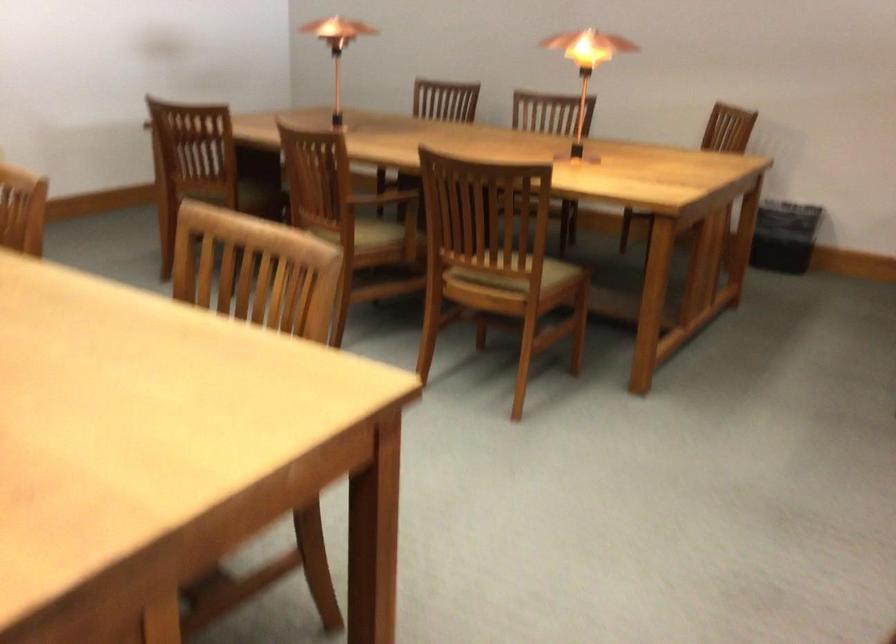
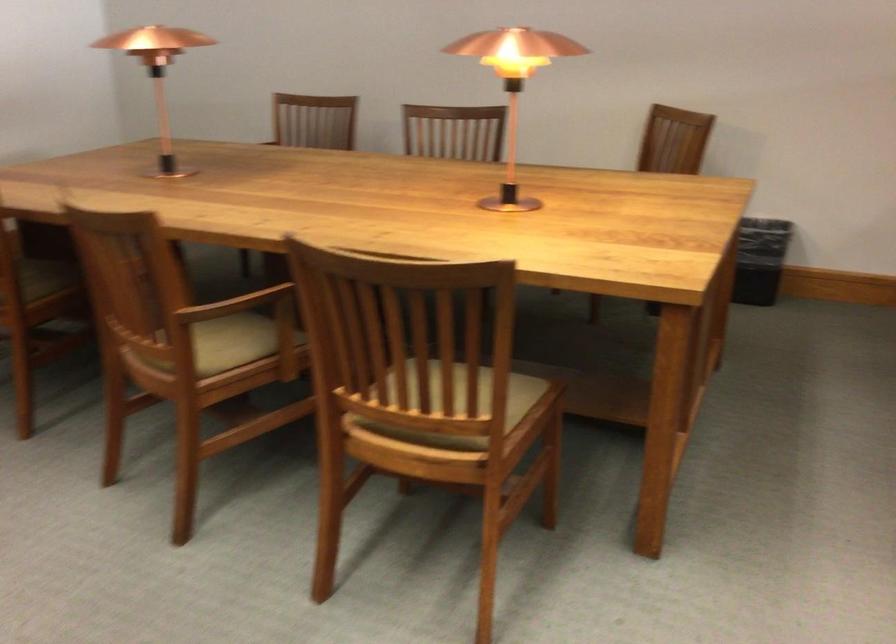
Where in the second image is the point corresponding to point (374, 223) from the first image?

(228, 343)